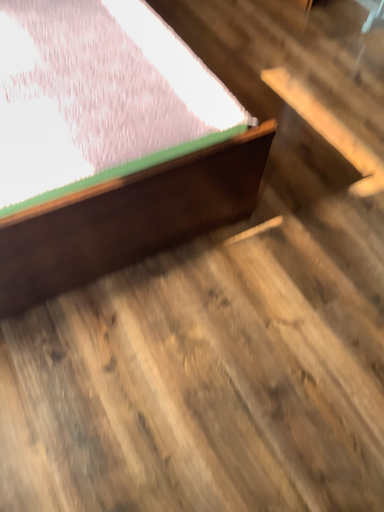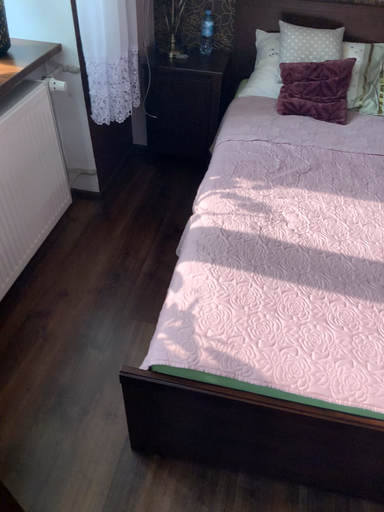
Question: Which way did the camera rotate in the video?

Choices:
 (A) rotated downward
 (B) rotated upward

Answer: (B)